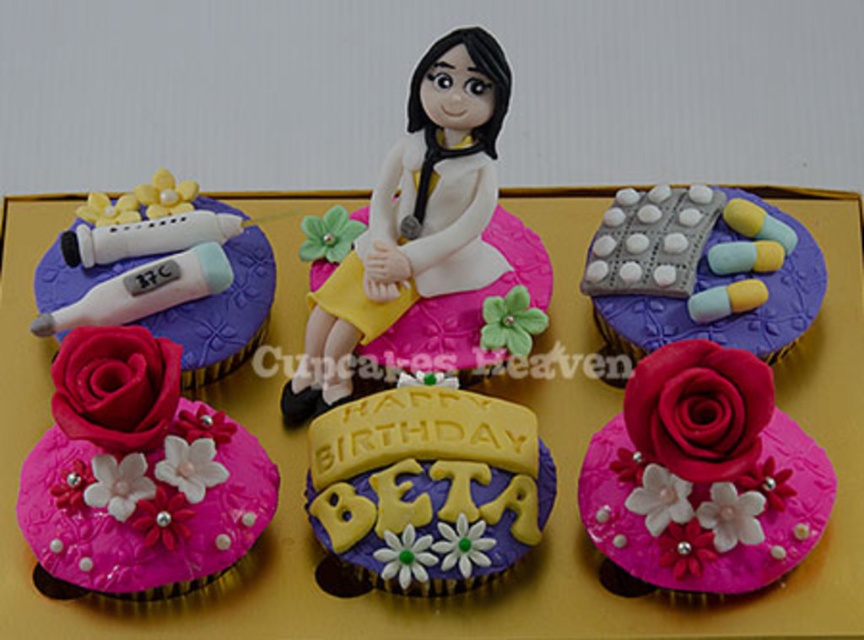
Can you confirm if matte pink rose at lower left is smaller than white glossy thermometer at upper left?

No, matte pink rose at lower left is not smaller than white glossy thermometer at upper left.

Is matte pink rose at lower left closer to camera compared to white glossy thermometer at upper left?

Yes.

Does point (750, 432) come behind point (246, 276)?

That is False.

At what (x,y) coordinates should I click in order to perform the action: click on matte pink rose at lower left. Please return your answer as a coordinate pair (x, y). The image size is (864, 640). Looking at the image, I should click on (703, 476).

Who is higher up, matte pink fondant rose at lower left or matte pink rose at lower left?

matte pink rose at lower left

Can you confirm if matte pink fondant rose at lower left is taller than matte pink rose at lower left?

Yes, matte pink fondant rose at lower left is taller than matte pink rose at lower left.

Is point (261, 509) less distant than point (703, 481)?

No, it is not.

This screenshot has width=864, height=640. I want to click on matte pink fondant rose at lower left, so click(137, 476).

Between point (763, 257) and point (191, 269), which one is positioned in front?

Point (191, 269) is more forward.

Can you confirm if gray pill blister pack at upper right is smaller than white glossy thermometer at upper left?

Yes.

Who is more forward, (687, 314) or (170, 250)?

Positioned in front is point (687, 314).

Find the location of a particular element. The image size is (864, 640). gray pill blister pack at upper right is located at coordinates (701, 272).